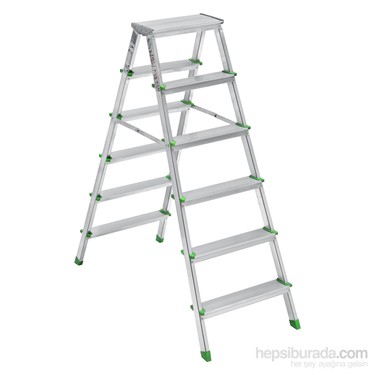
At what (x,y) coordinates should I click in order to perform the action: click on top step. Please return your answer as a coordinate pair (x, y). This screenshot has height=375, width=375. Looking at the image, I should click on (185, 23).